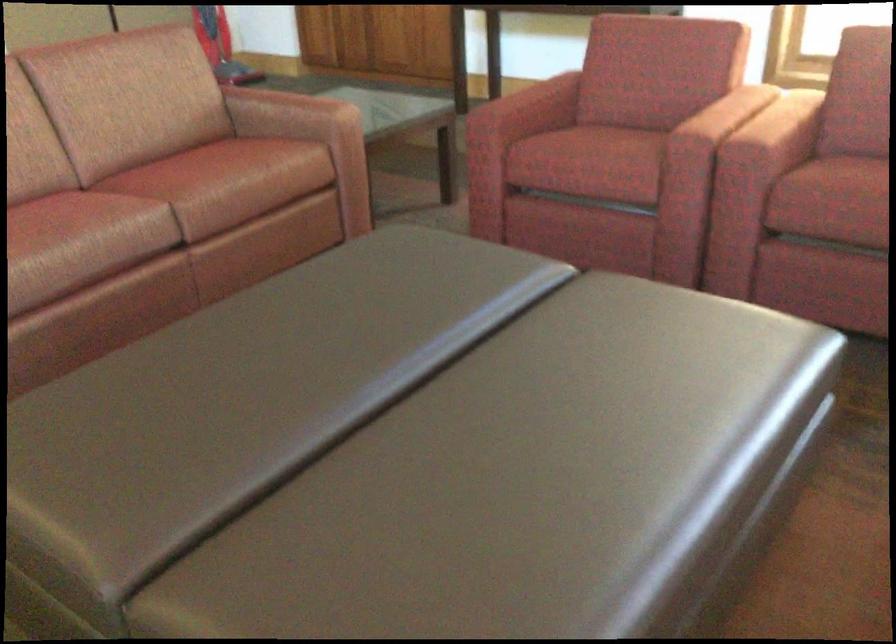
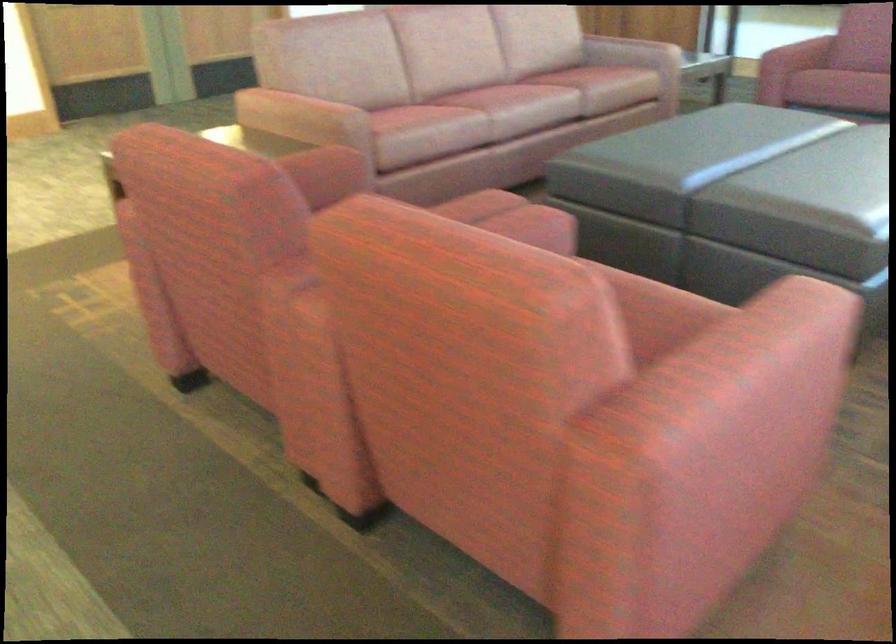
The images are taken continuously from a first-person perspective. In which direction are you moving?

The cameraman walked toward left, backward.